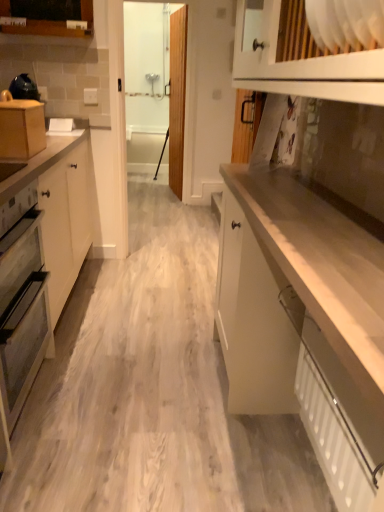
Where is `vacant area that is situated to the right of matte gray oven at left`? This screenshot has width=384, height=512. vacant area that is situated to the right of matte gray oven at left is located at coordinates (115, 408).